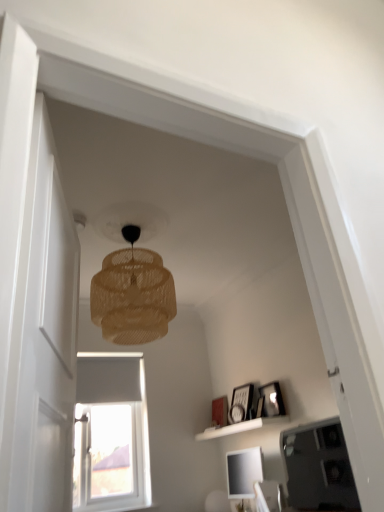
Question: From a real-world perspective, is matte white picture frame at center, which is counted as the first picture frame, starting from the left, over white matte shelf at lower center?

Choices:
 (A) yes
 (B) no

Answer: (A)

Question: Can you confirm if matte white picture frame at center, the third picture frame positioned from the front, is shorter than white matte shelf at lower center?

Choices:
 (A) yes
 (B) no

Answer: (B)

Question: Is matte white picture frame at center, the first picture frame from the back, positioned with its back to white matte shelf at lower center?

Choices:
 (A) no
 (B) yes

Answer: (A)

Question: Can we say matte white picture frame at center, the third picture frame positioned from the front, lies outside white matte shelf at lower center?

Choices:
 (A) no
 (B) yes

Answer: (B)

Question: Considering the relative sizes of matte white picture frame at center, placed as the 3th picture frame when sorted from right to left, and white matte shelf at lower center in the image provided, is matte white picture frame at center, placed as the 3th picture frame when sorted from right to left, wider than white matte shelf at lower center?

Choices:
 (A) no
 (B) yes

Answer: (A)

Question: Does point (38, 164) appear closer or farther from the camera than point (200, 437)?

Choices:
 (A) closer
 (B) farther

Answer: (A)

Question: In terms of width, does transparent glass door at left look wider or thinner when compared to white matte shelf at lower center?

Choices:
 (A) thin
 (B) wide

Answer: (A)

Question: Is transparent glass door at left bigger or smaller than white matte shelf at lower center?

Choices:
 (A) big
 (B) small

Answer: (A)

Question: Is transparent glass door at left situated inside white matte shelf at lower center or outside?

Choices:
 (A) inside
 (B) outside

Answer: (B)

Question: Considering the positions of wooden picture frame at upper right, positioned as the 1th picture frame in right-to-left order, and white matte shelf at lower center in the image, is wooden picture frame at upper right, positioned as the 1th picture frame in right-to-left order, taller or shorter than white matte shelf at lower center?

Choices:
 (A) short
 (B) tall

Answer: (B)

Question: From the image's perspective, is wooden picture frame at upper right, placed as the 3th picture frame when sorted from back to front, located above or below white matte shelf at lower center?

Choices:
 (A) above
 (B) below

Answer: (A)

Question: In the image, is wooden picture frame at upper right, placed as the 3th picture frame when sorted from back to front, positioned in front of or behind white matte shelf at lower center?

Choices:
 (A) behind
 (B) front

Answer: (A)

Question: Considering the positions of wooden picture frame at upper right, acting as the 3th picture frame starting from the left, and white matte shelf at lower center in the image, is wooden picture frame at upper right, acting as the 3th picture frame starting from the left, wider or thinner than white matte shelf at lower center?

Choices:
 (A) thin
 (B) wide

Answer: (A)

Question: Considering the positions of white matte shelf at lower center and translucent woven lampshade at upper center in the image, is white matte shelf at lower center bigger or smaller than translucent woven lampshade at upper center?

Choices:
 (A) big
 (B) small

Answer: (B)

Question: From a real-world perspective, is white matte shelf at lower center positioned above or below translucent woven lampshade at upper center?

Choices:
 (A) below
 (B) above

Answer: (A)